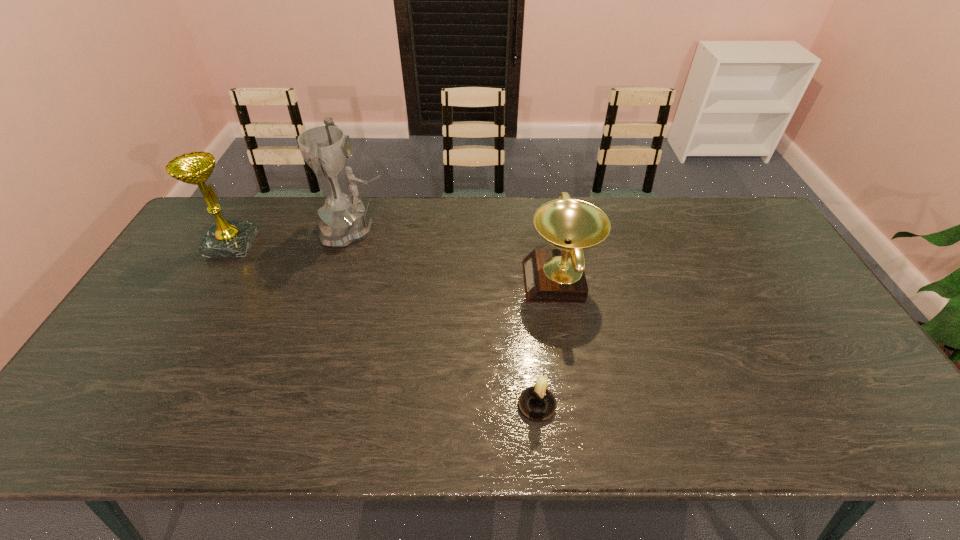
At what (x,y) coordinates should I click in order to perform the action: click on vacant space located on the front-facing side of the shortest award. Please return your answer as a coordinate pair (x, y). Looking at the image, I should click on (419, 282).

The height and width of the screenshot is (540, 960). I want to click on free space located 0.170m on the front-facing side of the shortest award, so click(467, 282).

This screenshot has height=540, width=960. In order to click on free space located on the front-facing side of the shortest award in this screenshot , I will do `click(416, 282)`.

The image size is (960, 540). Find the location of `vacant space located on the right of the candle holder`. vacant space located on the right of the candle holder is located at coordinates (616, 406).

You are a GUI agent. You are given a task and a screenshot of the screen. Output one action in this format:
    pyautogui.click(x=<x>, y=<y>)
    Task: Click on the object present at the near edge
    The height and width of the screenshot is (540, 960).
    Given the screenshot: What is the action you would take?
    pyautogui.click(x=537, y=403)

The height and width of the screenshot is (540, 960). Find the location of `object present at the left edge`. object present at the left edge is located at coordinates (225, 238).

Where is `object at the far left corner`? The width and height of the screenshot is (960, 540). object at the far left corner is located at coordinates (225, 238).

In the image, there is a desktop. Where is `blank space at the far edge`? Image resolution: width=960 pixels, height=540 pixels. blank space at the far edge is located at coordinates (318, 228).

Find the location of a particular element. The width and height of the screenshot is (960, 540). vacant space at the near edge of the desktop is located at coordinates (391, 430).

This screenshot has width=960, height=540. In the image, there is a desktop. Identify the location of vacant space at the left edge. (199, 272).